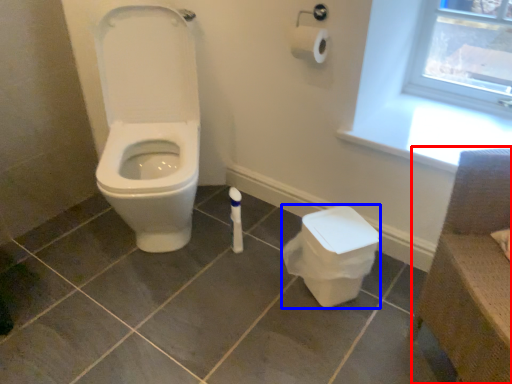
Question: Among these objects, which one is nearest to the camera, chair (highlighted by a red box) or potty (highlighted by a blue box)?

Choices:
 (A) chair
 (B) potty

Answer: (A)